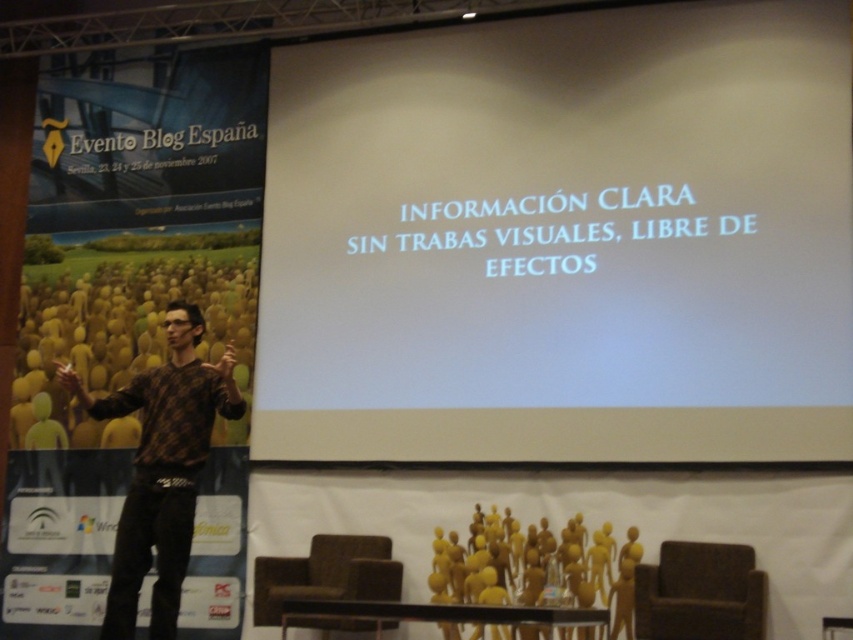
Is white matte projection screen at center shorter than brown textured sweater at center?

Indeed, white matte projection screen at center has a lesser height compared to brown textured sweater at center.

Does white matte projection screen at center lie behind brown textured sweater at center?

Yes, it is behind brown textured sweater at center.

Between point (708, 168) and point (125, 531), which one is positioned behind?

The point (708, 168) is behind.

Where is `white matte projection screen at center`? This screenshot has width=853, height=640. white matte projection screen at center is located at coordinates (561, 241).

Is brown fabric chair at lower right smaller than brown fabric chair at lower center?

Correct, brown fabric chair at lower right occupies less space than brown fabric chair at lower center.

Image resolution: width=853 pixels, height=640 pixels. What do you see at coordinates (700, 593) in the screenshot? I see `brown fabric chair at lower right` at bounding box center [700, 593].

Measure the distance between brown fabric chair at lower right and camera.

brown fabric chair at lower right and camera are 20.32 feet apart from each other.

Where is `brown fabric chair at lower right`? Image resolution: width=853 pixels, height=640 pixels. brown fabric chair at lower right is located at coordinates (700, 593).

Can you confirm if brown textured sweater at center is smaller than brown fabric chair at lower center?

No.

I want to click on brown textured sweater at center, so click(x=161, y=468).